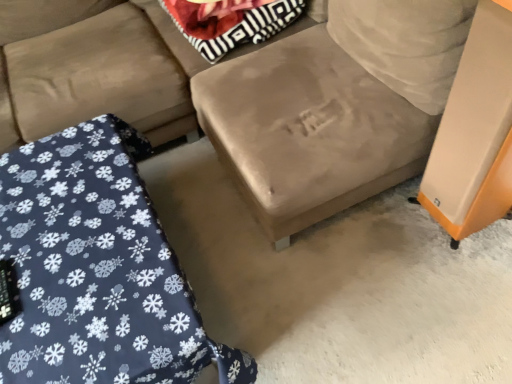
Question: From a real-world perspective, relative to orange matte speaker at right, is striped fabric pillow at upper center vertically above or below?

Choices:
 (A) above
 (B) below

Answer: (A)

Question: Does point coord(195,18) appear closer or farther from the camera than point coord(480,205)?

Choices:
 (A) farther
 (B) closer

Answer: (A)

Question: Which object is positioned farthest from the striped fabric pillow at upper center?

Choices:
 (A) blue fabric wrapping at lower left
 (B) orange matte speaker at right
 (C) velvet blue blanket at lower left
 (D) suede-like beige couch at center

Answer: (B)

Question: Which of these objects is positioned closest to the velvet blue blanket at lower left?

Choices:
 (A) blue fabric wrapping at lower left
 (B) suede-like beige couch at center
 (C) orange matte speaker at right
 (D) striped fabric pillow at upper center

Answer: (B)